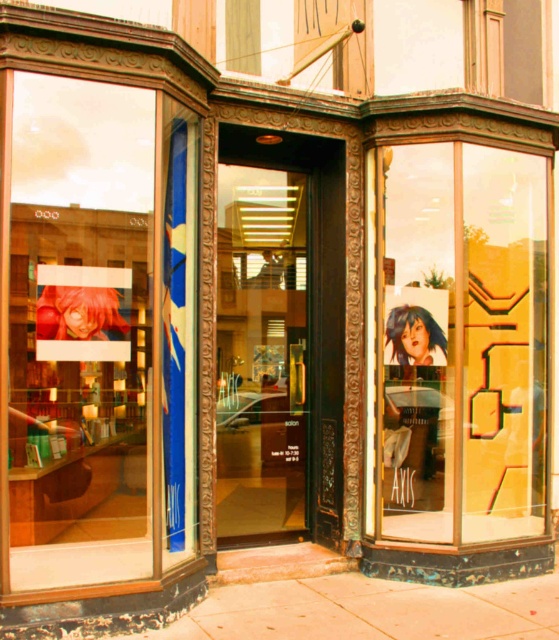
From the picture: You are standing outside the store entrance of AXIS. You want to enter the store but there is a security barrier that requires you to be exactly 6 meters away from the point marked at coordinates point (x=60, y=328) to pass through. Can you safely enter the store?

The distance between you and point (x=60, y=328) is 6.05 meters, which is slightly more than the required 6 meters. Therefore, you cannot safely enter the store as you are 0.05 meters too far from the required distance.

You are a customer entering the store and notice two mannequins with different hairstyles. The blue hair doll at center and the smooth red hair at left. Which hairstyle is taller?

The blue hair doll at center is taller than the smooth red hair at left.

You are a customer entering the store and see two characters with smooth red hair at left and smooth blue hair at upper right. Which character is positioned further to the left side of the store?

The smooth red hair at left is positioned further to the left side of the store than the smooth blue hair at upper right.